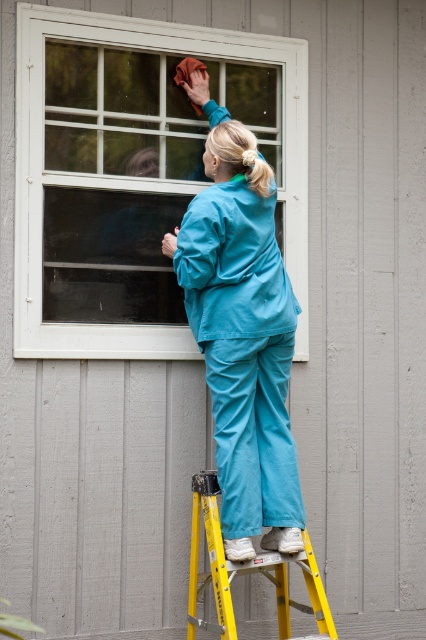
Question: Where is white matte window at upper center located in relation to teal fabric pants at center in the image?

Choices:
 (A) right
 (B) left

Answer: (B)

Question: Considering the real-world distances, which object is closest to the yellow metallic ladder at lower center?

Choices:
 (A) white matte window at upper center
 (B) teal fabric pants at center

Answer: (B)

Question: Does teal fabric pants at center have a smaller size compared to yellow metallic ladder at lower center?

Choices:
 (A) yes
 (B) no

Answer: (B)

Question: Can you confirm if white matte window at upper center is thinner than teal fabric pants at center?

Choices:
 (A) yes
 (B) no

Answer: (B)

Question: Among these objects, which one is farthest from the camera?

Choices:
 (A) yellow metallic ladder at lower center
 (B) white matte window at upper center
 (C) teal fabric pants at center

Answer: (B)

Question: Which object is farther from the camera taking this photo?

Choices:
 (A) yellow metallic ladder at lower center
 (B) teal fabric pants at center
 (C) white matte window at upper center

Answer: (C)